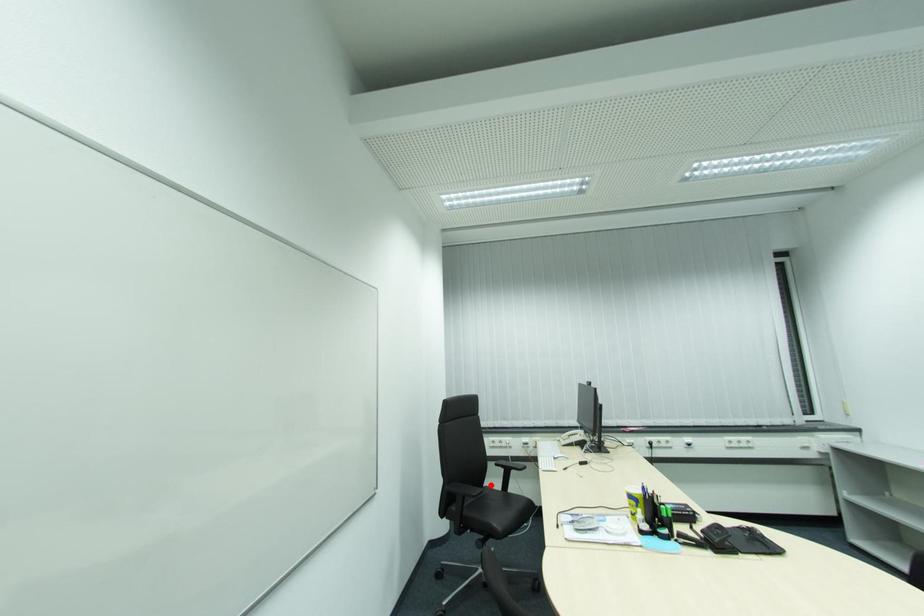
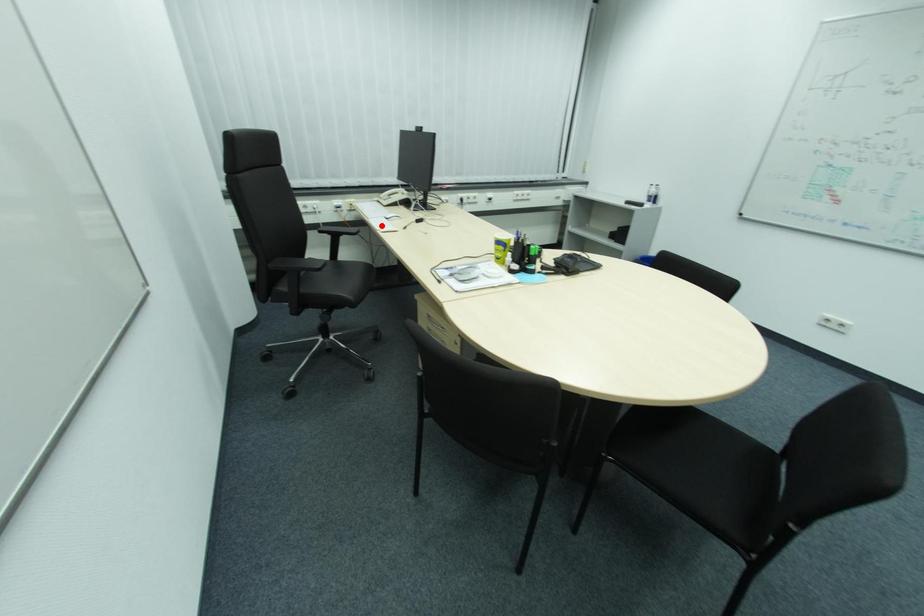
I am providing you with two images of the same scene from different viewpoints. A red point is marked on the first image and another point is marked on the second image. Are the points marked in image1 and image2 representing the same 3D position?

No